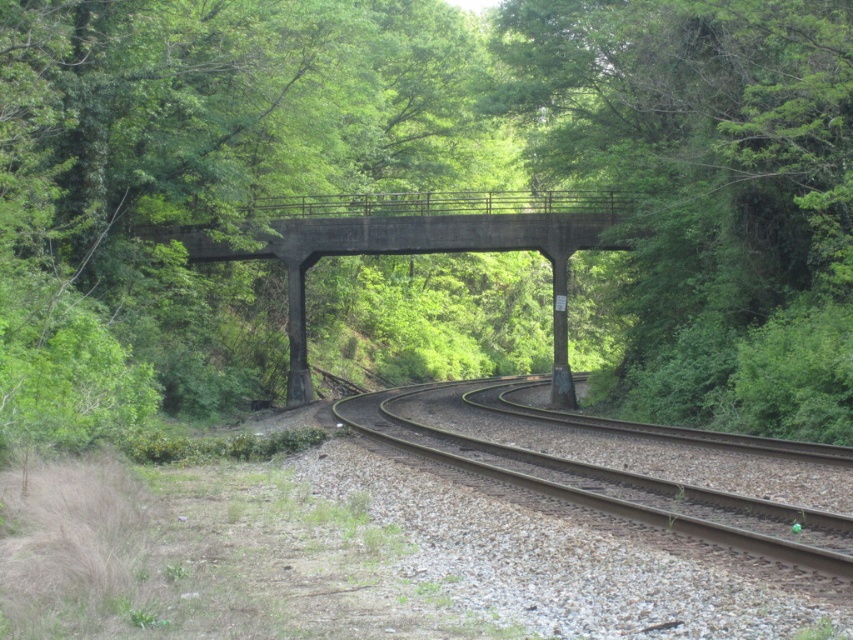
Question: Observing the image, what is the correct spatial positioning of green leafy tree at center in reference to brown gravel track at center?

Choices:
 (A) below
 (B) above

Answer: (B)

Question: Which of the following is the farthest from the observer?

Choices:
 (A) (553, 310)
 (B) (155, 16)
 (C) (660, 305)

Answer: (A)

Question: Can you confirm if metal/smooth track at center is positioned to the left of brown gravel track at center?

Choices:
 (A) no
 (B) yes

Answer: (B)

Question: Does green leafy tree at center have a larger size compared to metal/smooth track at center?

Choices:
 (A) yes
 (B) no

Answer: (A)

Question: Which point is farther to the camera?

Choices:
 (A) (3, 198)
 (B) (670, 506)
 (C) (515, 410)

Answer: (C)

Question: Which object is the closest to the green leafy tree at upper center?

Choices:
 (A) brown gravel track at center
 (B) metal/smooth track at center

Answer: (A)